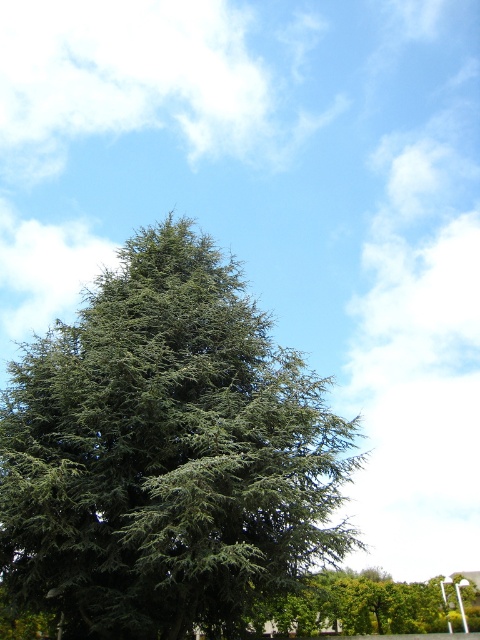
Does green needle-like at center appear under green leafy tree at center?

No.

Between point (193, 620) and point (379, 589), which one is positioned behind?

The point (379, 589) is behind.

Identify the location of green needle-like at center. The image size is (480, 640). (167, 452).

Find the location of a particular element. This screenshot has height=640, width=480. green needle-like at center is located at coordinates (167, 452).